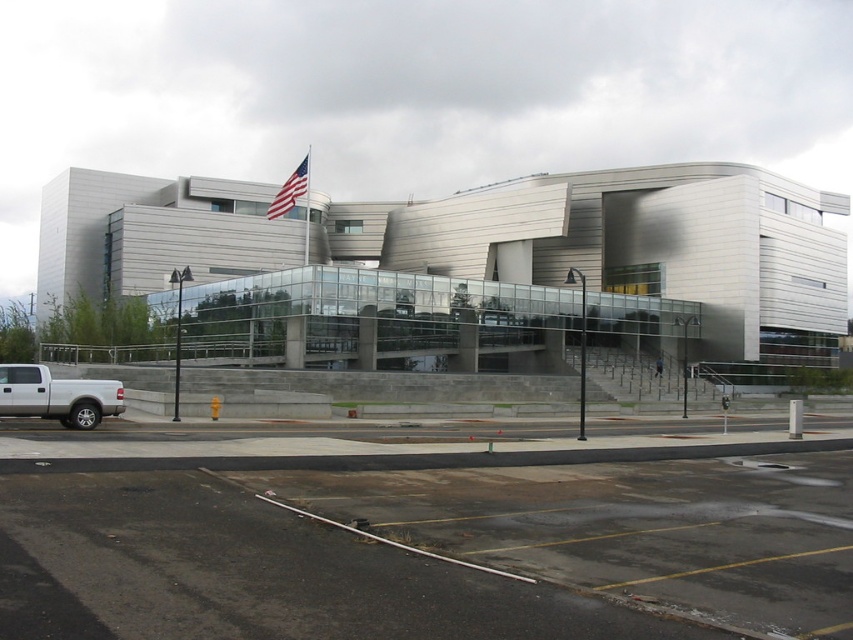
You are a visitor approaching the building and notice the dark asphalt parking lot at lower center and the american flag at upper center. Which object is located lower in the scene?

The dark asphalt parking lot at lower center is positioned under the american flag at upper center, so the parking lot is lower than the flag.

You are standing at the entrance of the modern building and see the white matte truck at lower left and the american flag at upper center. Which object appears narrower when viewed from your current position?

The white matte truck at lower left appears narrower than the american flag at upper center.